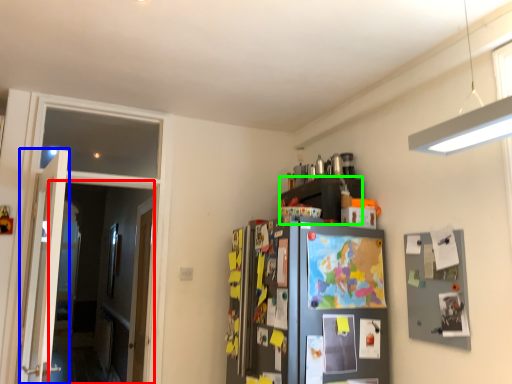
Question: Which object is the closest to the glass door (highlighted by a red box)? Choose among these: door (highlighted by a blue box) or cabinetry (highlighted by a green box).

Choices:
 (A) door
 (B) cabinetry

Answer: (A)